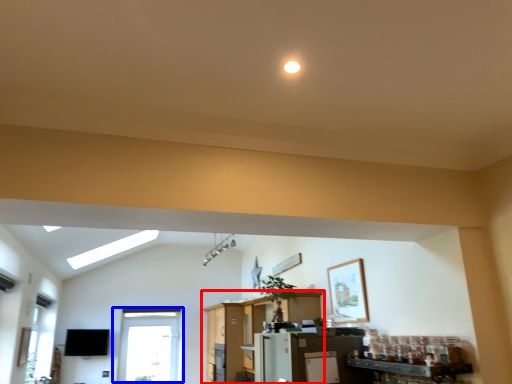
Question: Which object appears farthest to the camera in this image, entertainment center (highlighted by a red box) or window (highlighted by a blue box)?

Choices:
 (A) entertainment center
 (B) window

Answer: (B)